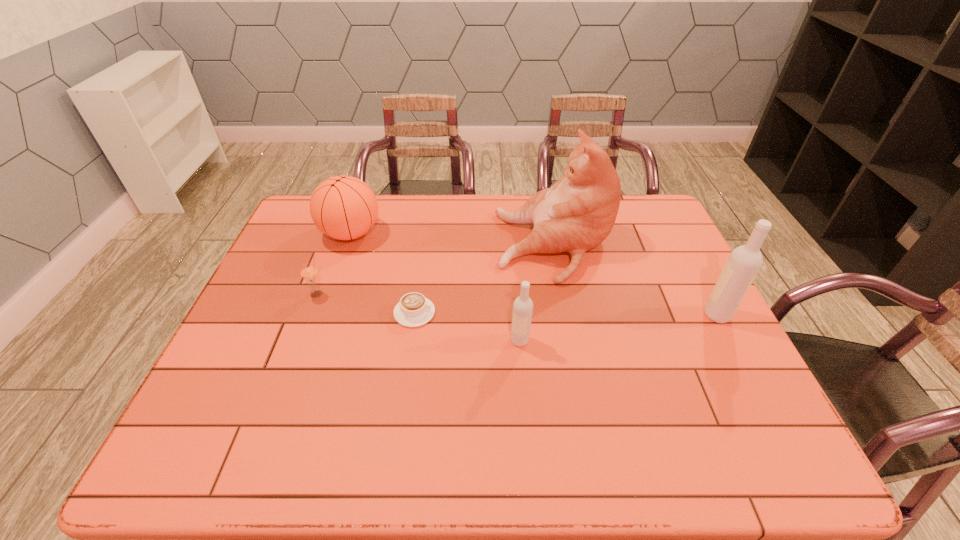
This screenshot has width=960, height=540. I want to click on free space that satisfies the following two spatial constraints: 1. on the front side of the rightmost object; 2. on the left side of the basketball, so click(322, 315).

At what (x,y) coordinates should I click in order to perform the action: click on free location that satisfies the following two spatial constraints: 1. with the handle on the right side of the cappuccino; 2. on the back side of the nearer vodka. Please return your answer as a coordinate pair (x, y). The image size is (960, 540). Looking at the image, I should click on (411, 340).

What are the coordinates of `free spot that satisfies the following two spatial constraints: 1. with the handle on the right side of the third object from left to right; 2. on the back side of the taller vodka` in the screenshot? It's located at (414, 315).

I want to click on free space in the image that satisfies the following two spatial constraints: 1. on the back side of the nearer vodka; 2. with the handle on the right side of the shortest object, so click(517, 313).

Image resolution: width=960 pixels, height=540 pixels. In order to click on blank area in the image that satisfies the following two spatial constraints: 1. with the handle on the right side of the shortest object; 2. on the left side of the taller vodka in this screenshot , I will do `click(414, 315)`.

Identify the location of blank space that satisfies the following two spatial constraints: 1. on the face of the taller vodka; 2. on the left side of the cat. (567, 315).

This screenshot has width=960, height=540. Identify the location of free spot that satisfies the following two spatial constraints: 1. on the back side of the nearer vodka; 2. on the right side of the right vodka. (517, 315).